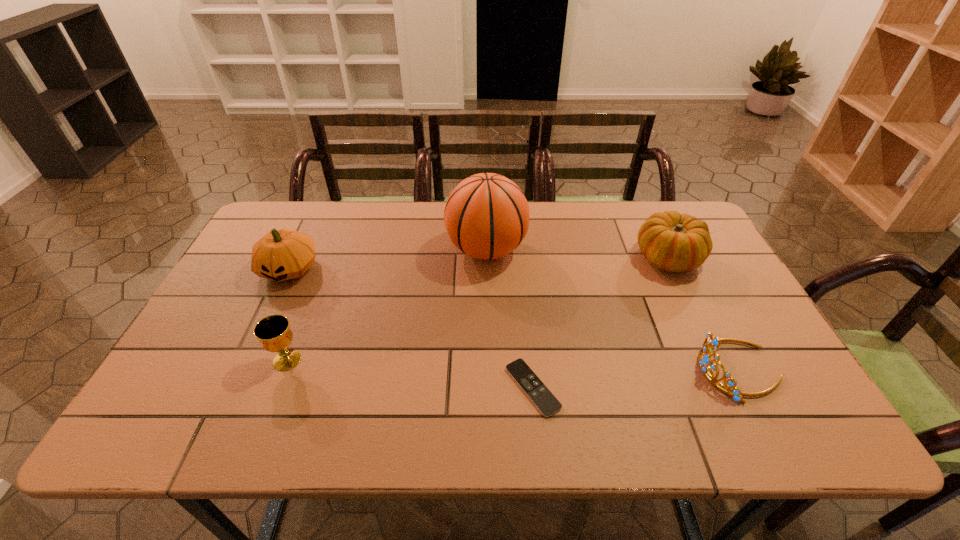
Locate an element on the screen. free spot located 0.270m on the front-facing side of the tiara is located at coordinates (584, 369).

Identify the location of vacant position located 0.220m on the front-facing side of the tiara. This screenshot has width=960, height=540. (606, 369).

This screenshot has height=540, width=960. Identify the location of vacant space located on the front-facing side of the tiara. (678, 369).

Identify the location of free spot located on the right of the shortest object. This screenshot has width=960, height=540. (682, 388).

The width and height of the screenshot is (960, 540). Find the location of `basketball that is at the far edge`. basketball that is at the far edge is located at coordinates (486, 216).

Locate an element on the screen. The width and height of the screenshot is (960, 540). gourd that is positioned at the far edge is located at coordinates (672, 242).

Find the location of a particular element. This screenshot has width=960, height=540. tiara at the near edge is located at coordinates (710, 342).

This screenshot has width=960, height=540. Identify the location of remote control situated at the near edge. (539, 394).

Where is `object that is at the left edge`? object that is at the left edge is located at coordinates (283, 254).

Find the location of a particular element. gourd at the right edge is located at coordinates (672, 242).